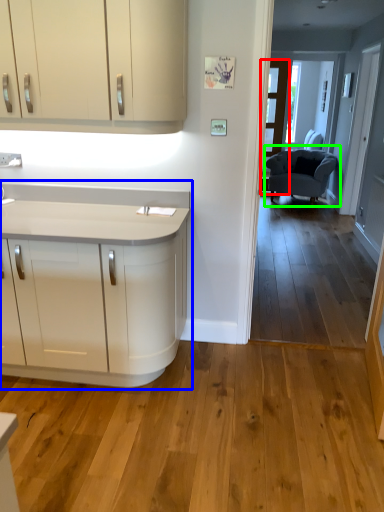
Question: Which object is the closest to the glass door (highlighted by a red box)? Choose among these: countertop (highlighted by a blue box) or chair (highlighted by a green box).

Choices:
 (A) countertop
 (B) chair

Answer: (B)